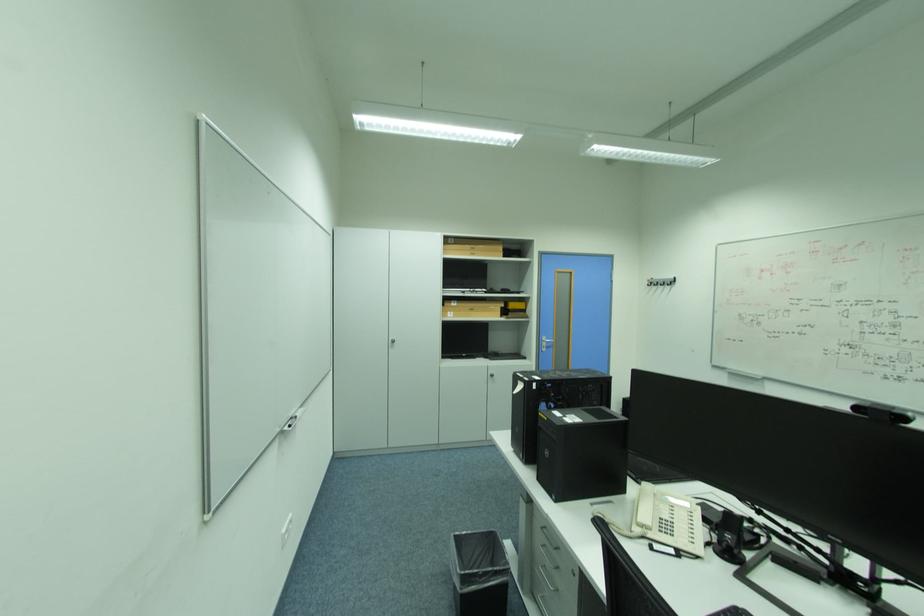
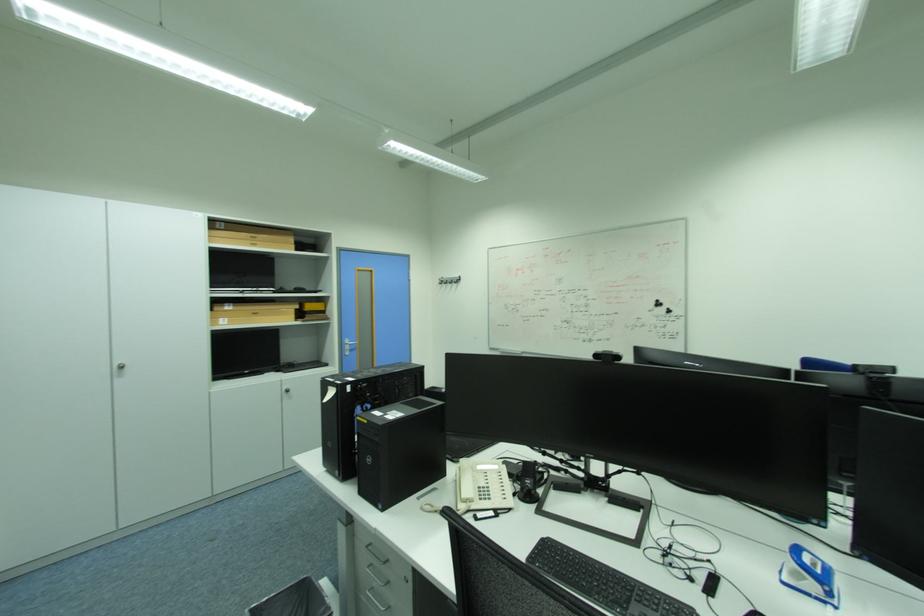
The point at [456,313] is marked in the first image. Where is the corresponding point in the second image?

(228, 320)